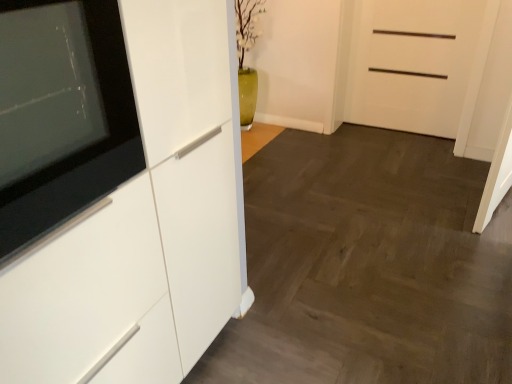
Question: Is white glossy cabinet at left a part of black glossy tv at left?

Choices:
 (A) no
 (B) yes

Answer: (A)

Question: Is black glossy tv at left turned away from white glossy cabinet at left?

Choices:
 (A) yes
 (B) no

Answer: (B)

Question: From the image's perspective, is black glossy tv at left under white glossy cabinet at left?

Choices:
 (A) no
 (B) yes

Answer: (A)

Question: Considering the relative sizes of black glossy tv at left and white glossy cabinet at left in the image provided, is black glossy tv at left bigger than white glossy cabinet at left?

Choices:
 (A) no
 (B) yes

Answer: (A)

Question: Is black glossy tv at left wider than white glossy cabinet at left?

Choices:
 (A) no
 (B) yes

Answer: (A)

Question: Considering their positions, is black glossy tv at left located in front of or behind white matte door at upper right?

Choices:
 (A) behind
 (B) front

Answer: (B)

Question: Considering the positions of black glossy tv at left and white matte door at upper right in the image, is black glossy tv at left taller or shorter than white matte door at upper right?

Choices:
 (A) short
 (B) tall

Answer: (A)

Question: Is point (120, 52) positioned closer to the camera than point (353, 114)?

Choices:
 (A) farther
 (B) closer

Answer: (B)

Question: Is black glossy tv at left spatially inside white matte door at upper right, or outside of it?

Choices:
 (A) inside
 (B) outside

Answer: (B)

Question: Is point (283, 228) closer or farther from the camera than point (129, 92)?

Choices:
 (A) farther
 (B) closer

Answer: (A)

Question: Considering their positions, is white glossy cabinet at left located in front of or behind black glossy tv at left?

Choices:
 (A) front
 (B) behind

Answer: (B)

Question: Considering the positions of white glossy cabinet at left and black glossy tv at left in the image, is white glossy cabinet at left bigger or smaller than black glossy tv at left?

Choices:
 (A) small
 (B) big

Answer: (B)

Question: From a real-world perspective, is white glossy cabinet at left positioned above or below black glossy tv at left?

Choices:
 (A) above
 (B) below

Answer: (B)

Question: From a real-world perspective, is white glossy cabinet at left positioned above or below white matte door at upper right?

Choices:
 (A) below
 (B) above

Answer: (A)

Question: Does point (321, 281) appear closer or farther from the camera than point (424, 82)?

Choices:
 (A) farther
 (B) closer

Answer: (B)